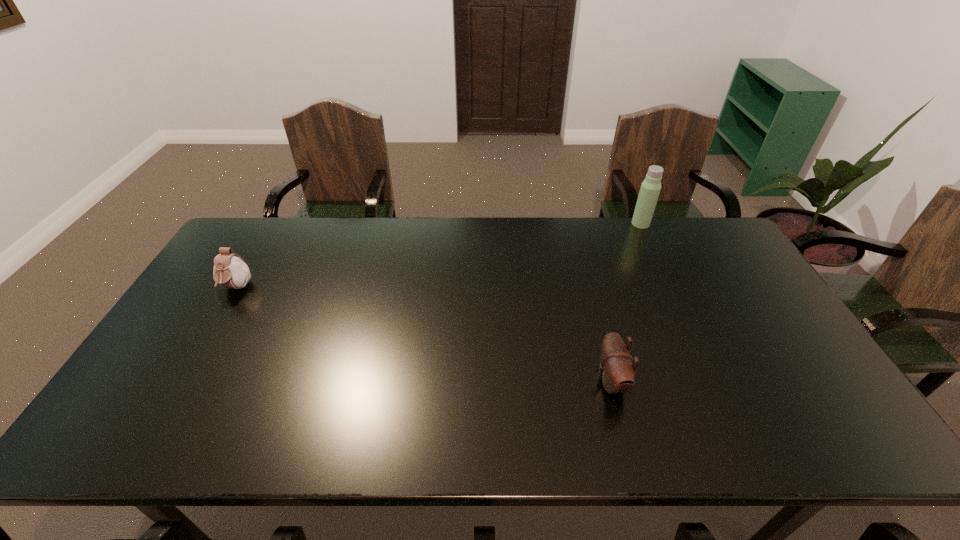
Where is `free space between the tallest object and the nearest object`? The image size is (960, 540). free space between the tallest object and the nearest object is located at coordinates (626, 302).

Identify the location of vacant region between the thermos bottle and the farther pouch. (439, 256).

This screenshot has height=540, width=960. Find the location of `free spot between the second object from left to right and the thermos bottle`. free spot between the second object from left to right and the thermos bottle is located at coordinates (626, 302).

I want to click on vacant area that lies between the farther pouch and the nearer pouch, so click(423, 335).

Identify the location of vacant space in between the tallest object and the right pouch. (626, 302).

This screenshot has width=960, height=540. Find the location of `empty location between the farthest object and the second object from left to right`. empty location between the farthest object and the second object from left to right is located at coordinates (626, 302).

The height and width of the screenshot is (540, 960). Find the location of `vacant area that lies between the rightmost object and the second object from left to right`. vacant area that lies between the rightmost object and the second object from left to right is located at coordinates (626, 302).

Locate an element on the screen. free space between the farthest object and the right pouch is located at coordinates (626, 302).

Identify which object is located as the nearest to the left pouch. Please provide its 2D coordinates. Your answer should be formatted as a tuple, i.e. [(x, y)], where the tuple contains the x and y coordinates of a point satisfying the conditions above.

[(617, 372)]

Identify which object is located as the second nearest to the thermos bottle. Please provide its 2D coordinates. Your answer should be formatted as a tuple, i.e. [(x, y)], where the tuple contains the x and y coordinates of a point satisfying the conditions above.

[(230, 270)]